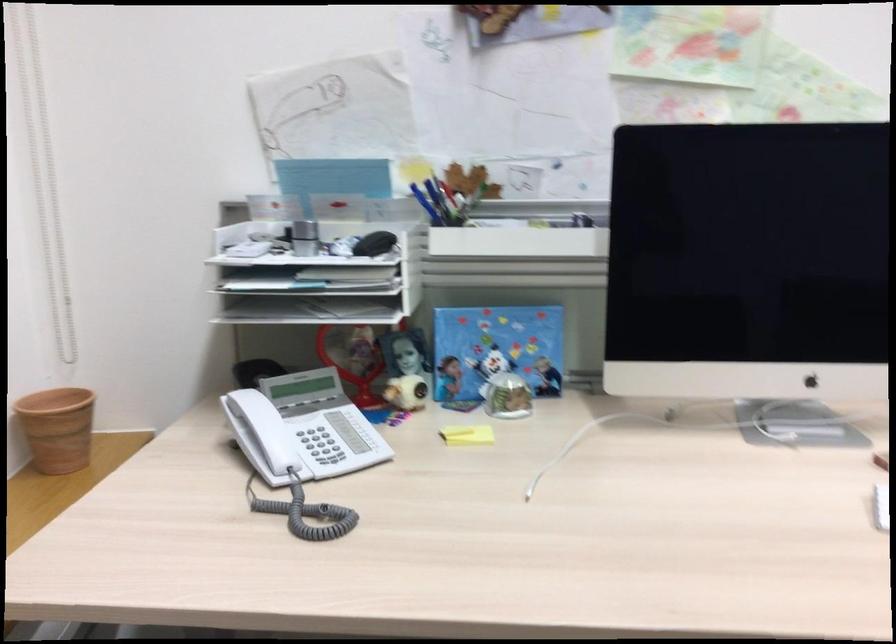
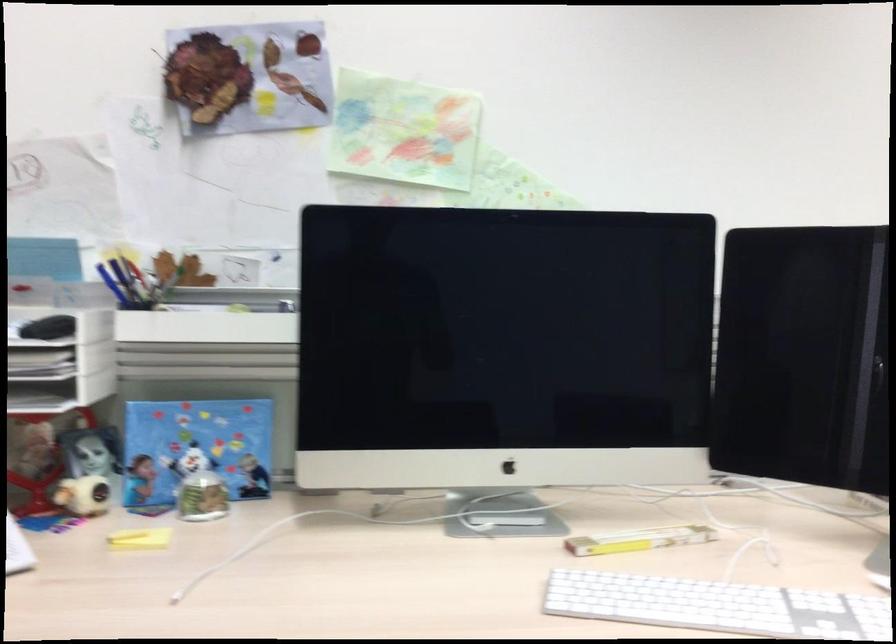
Find the pixel in the second image that matches point 406,390 in the first image.

(83, 495)